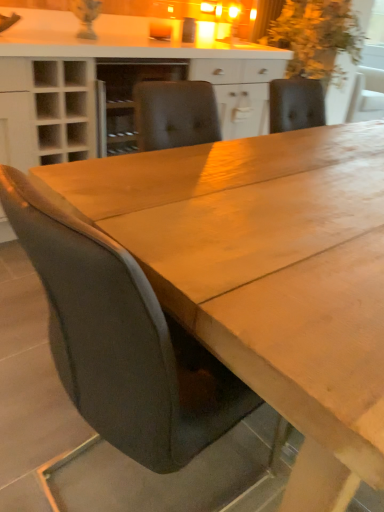
Locate an element on the screen. The image size is (384, 512). dark gray fabric chair at center is located at coordinates (121, 341).

What do you see at coordinates (121, 341) in the screenshot?
I see `dark gray fabric chair at center` at bounding box center [121, 341].

Where is `dark gray fabric chair at center`? dark gray fabric chair at center is located at coordinates (121, 341).